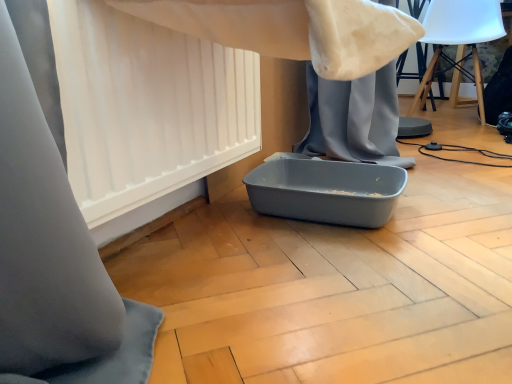
Question: Is point (480, 114) positioned closer to the camera than point (76, 162)?

Choices:
 (A) farther
 (B) closer

Answer: (A)

Question: Is white plastic swivel chair at upper right taller or shorter than white matte curtain at lower left?

Choices:
 (A) tall
 (B) short

Answer: (A)

Question: Looking at their shapes, would you say white plastic swivel chair at upper right is wider or thinner than white matte curtain at lower left?

Choices:
 (A) wide
 (B) thin

Answer: (A)

Question: Would you say white matte curtain at lower left is to the left or to the right of white plastic swivel chair at upper right in the picture?

Choices:
 (A) right
 (B) left

Answer: (B)

Question: In terms of size, does white matte curtain at lower left appear bigger or smaller than white plastic swivel chair at upper right?

Choices:
 (A) small
 (B) big

Answer: (A)

Question: From the image's perspective, relative to white plastic swivel chair at upper right, is white matte curtain at lower left above or below?

Choices:
 (A) below
 (B) above

Answer: (A)

Question: In terms of height, does white matte curtain at lower left look taller or shorter compared to white plastic swivel chair at upper right?

Choices:
 (A) tall
 (B) short

Answer: (B)